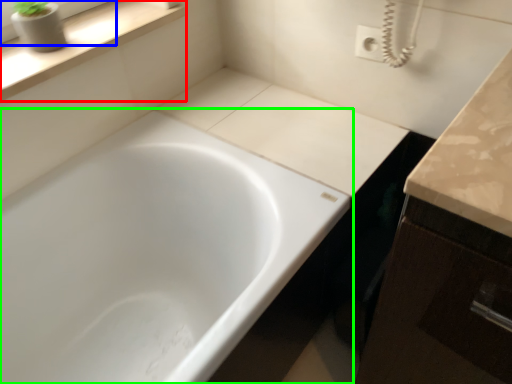
Question: Based on their relative distances, which object is farther from window sill (highlighted by a red box)? Choose from window frame (highlighted by a blue box) and bathtub (highlighted by a green box).

Choices:
 (A) window frame
 (B) bathtub

Answer: (B)